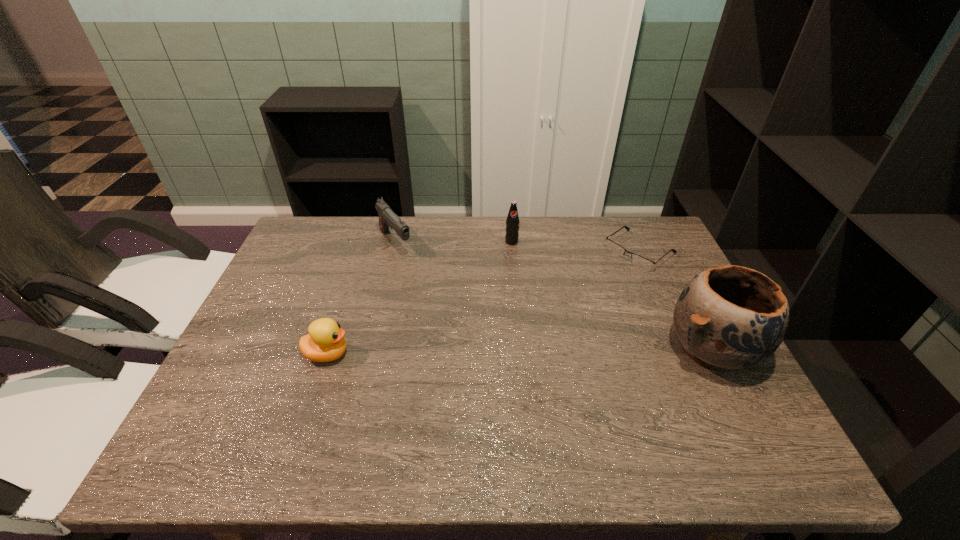
This screenshot has height=540, width=960. I want to click on vacant spot on the desktop that is between the duckling and the tallest object and is positioned in the direction the gun is aimed, so click(x=492, y=352).

This screenshot has width=960, height=540. Find the location of `free spot on the desktop that is between the second shortest object and the pottery and is positioned on the front-facing side of the shortest object`. free spot on the desktop that is between the second shortest object and the pottery and is positioned on the front-facing side of the shortest object is located at coordinates (508, 352).

Identify the location of free spot on the desktop that is between the duckling and the tallest object and is positioned on the front label of the pop. (556, 351).